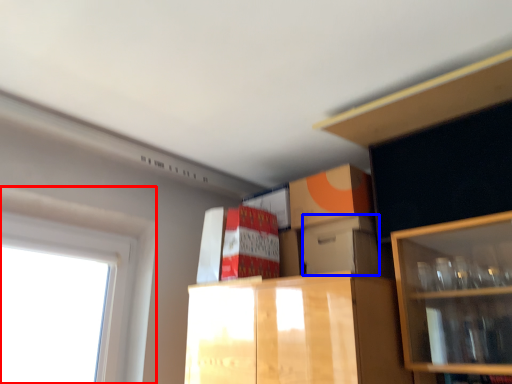
Question: Which object appears farthest to the camera in this image, window (highlighted by a red box) or storage box (highlighted by a blue box)?

Choices:
 (A) window
 (B) storage box

Answer: (B)